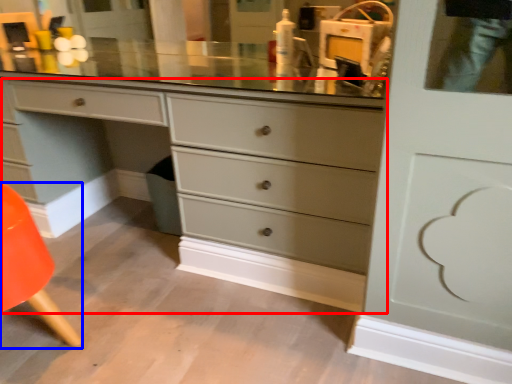
Question: Among these objects, which one is nearest to the camera, chest of drawers (highlighted by a red box) or armchair (highlighted by a blue box)?

Choices:
 (A) chest of drawers
 (B) armchair

Answer: (B)